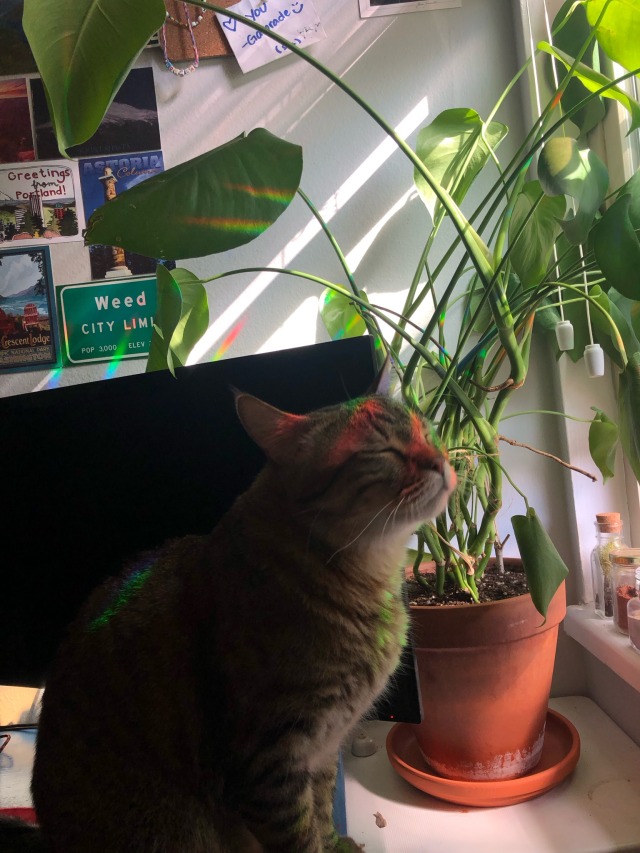
Locate an element on the screen. The height and width of the screenshot is (853, 640). plant pot is located at coordinates (483, 705).